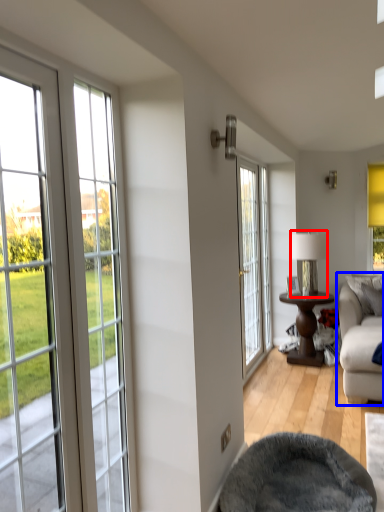
Question: Which object appears closest to the camera in this image, lamp (highlighted by a red box) or studio couch (highlighted by a blue box)?

Choices:
 (A) lamp
 (B) studio couch

Answer: (B)